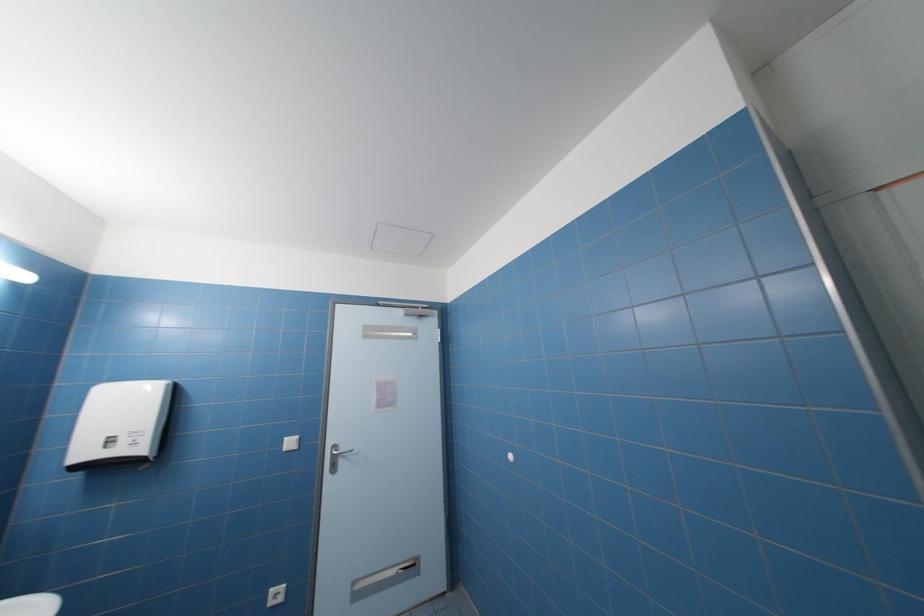
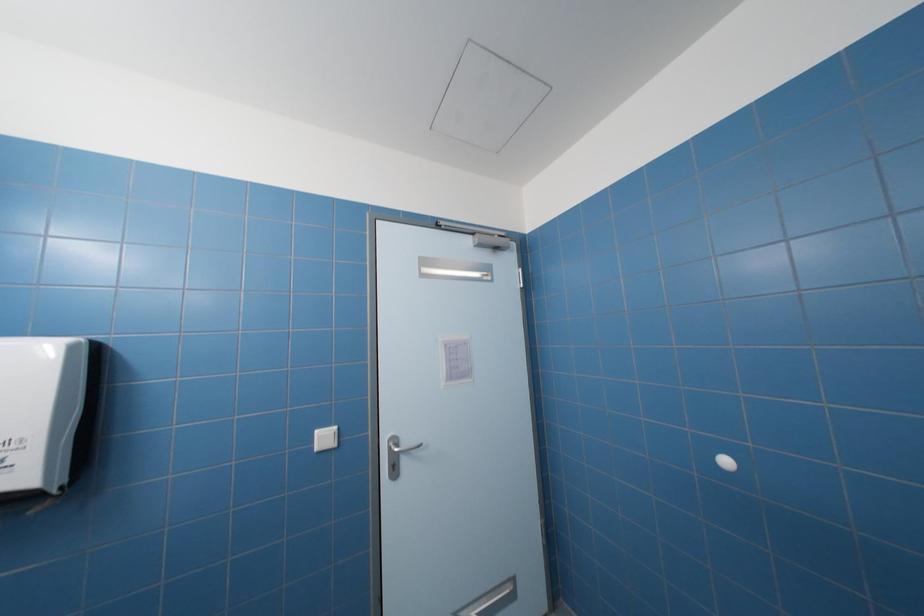
In a continuous first-person perspective shot, in which direction is the camera moving?

The cameraman walked toward left, forward.